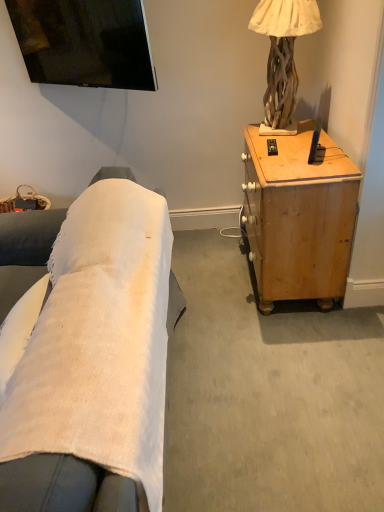
I want to click on free space above light brown wood desk at right (from a real-world perspective), so click(293, 144).